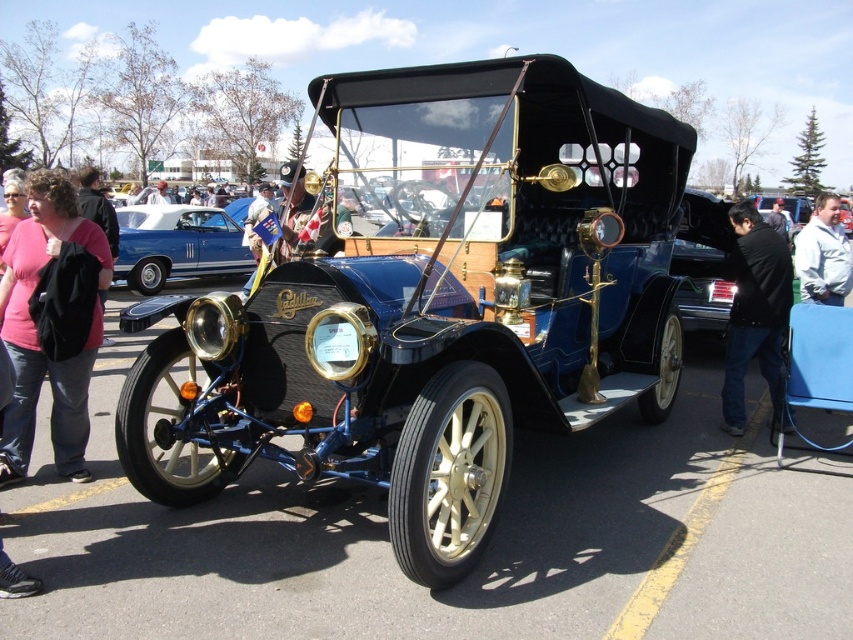
You are a photographer standing at the origin point of the coordinate system, which is the bottom left corner of the image. You want to capture a photo of the shiny blue car at center. Given that your camera has a field of view that can only cover a 0.5 unit radius around your current position, where should you position yourself to ensure the car is within the frame?

To ensure the shiny blue car at center is within the camera field of view, you should position yourself within a 0.5 unit radius of its coordinates at point (177, 244). For example, standing at coordinates approximately (177, 244) would place the car directly in the center of your frame.